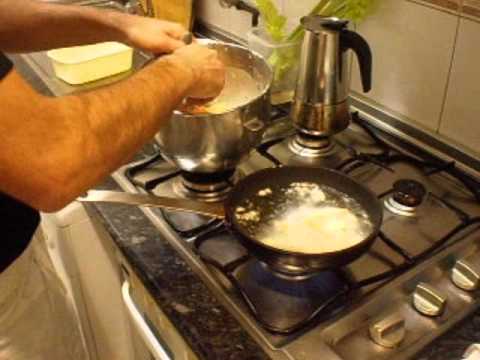
The image size is (480, 360). What are the coordinates of `right handle` in the screenshot? It's located at (52, 142).